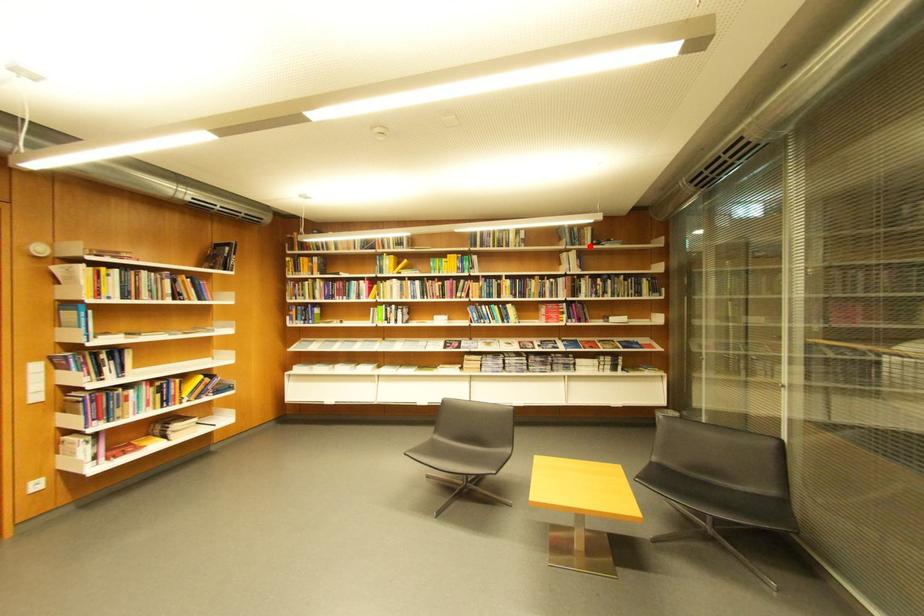
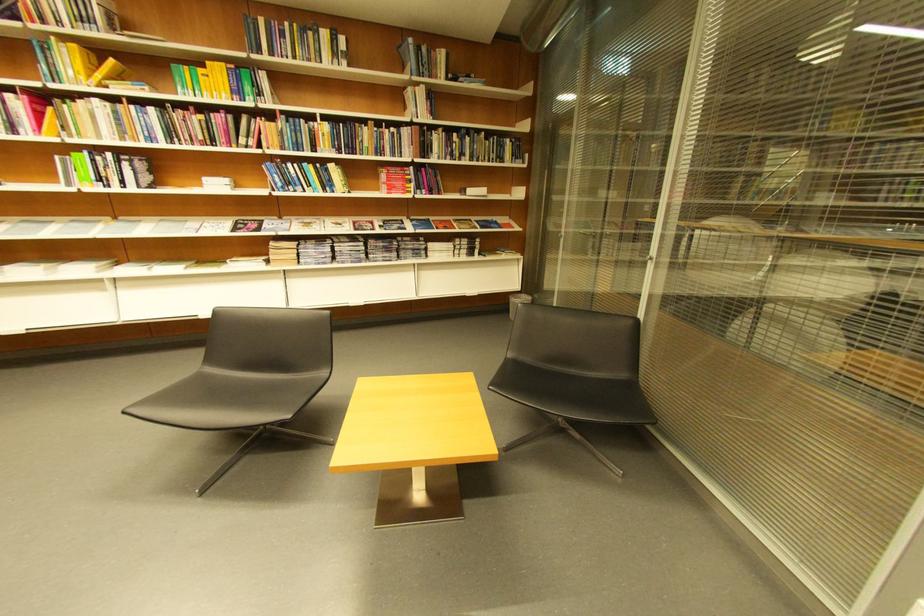
Where in the second image is the point corresponding to the highlighted location from the first image?

(441, 78)